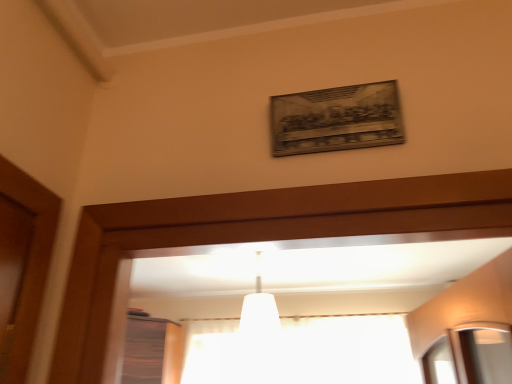
Image resolution: width=512 pixels, height=384 pixels. Describe the element at coordinates (259, 311) in the screenshot. I see `white matte lampshade at center` at that location.

Find the location of `white matte lampshade at center`. white matte lampshade at center is located at coordinates (259, 311).

What do you see at coordinates (347, 349) in the screenshot? The height and width of the screenshot is (384, 512). I see `white fabric curtain at center` at bounding box center [347, 349].

Where is `white fabric curtain at center`? The image size is (512, 384). white fabric curtain at center is located at coordinates (347, 349).

Where is `white matte lampshade at center`? Image resolution: width=512 pixels, height=384 pixels. white matte lampshade at center is located at coordinates (x=259, y=311).

Between white fabric curtain at center and white matte lampshade at center, which one appears on the right side from the viewer's perspective?

From the viewer's perspective, white fabric curtain at center appears more on the right side.

Which is in front, white fabric curtain at center or white matte lampshade at center?

white matte lampshade at center is closer to the camera.

Is point (347, 372) closer or farther from the camera than point (261, 319)?

Point (347, 372).

From the picture: From the image's perspective, is white fabric curtain at center above or below white matte lampshade at center?

white fabric curtain at center is below white matte lampshade at center.

From a real-world perspective, is white fabric curtain at center physically below white matte lampshade at center?

Yes, from a real-world perspective, white fabric curtain at center is under white matte lampshade at center.

In the scene shown: Considering the relative sizes of white fabric curtain at center and white matte lampshade at center in the image provided, is white fabric curtain at center wider than white matte lampshade at center?

No.

Considering the sizes of white fabric curtain at center and white matte lampshade at center in the image, is white fabric curtain at center taller or shorter than white matte lampshade at center?

white fabric curtain at center is shorter than white matte lampshade at center.

Consider the image. Considering the relative sizes of white fabric curtain at center and white matte lampshade at center in the image provided, is white fabric curtain at center smaller than white matte lampshade at center?

Incorrect, white fabric curtain at center is not smaller in size than white matte lampshade at center.

Is white fabric curtain at center inside the boundaries of white matte lampshade at center, or outside?

white fabric curtain at center is not enclosed by white matte lampshade at center.

Is white fabric curtain at center with white matte lampshade at center?

No, white fabric curtain at center is not next to white matte lampshade at center.

Is white fabric curtain at center turned away from white matte lampshade at center?

No, white fabric curtain at center is not facing the opposite direction of white matte lampshade at center.

The width and height of the screenshot is (512, 384). I want to click on fixture above the white fabric curtain at center (from the image's perspective), so click(x=259, y=311).

Which is more to the right, white matte lampshade at center or white fabric curtain at center?

white fabric curtain at center.

Does white matte lampshade at center lie in front of white fabric curtain at center?

Yes, it is in front of white fabric curtain at center.

Is point (272, 299) closer to camera compared to point (311, 333)?

Yes, it is.

From the image's perspective, between white matte lampshade at center and white fabric curtain at center, who is located below?

white fabric curtain at center appears lower in the image.

From a real-world perspective, which object rests below the other?

From a 3D spatial view, white fabric curtain at center is below.

Is white matte lampshade at center wider than white fabric curtain at center?

Indeed, white matte lampshade at center has a greater width compared to white fabric curtain at center.

Is white matte lampshade at center taller than white fabric curtain at center?

Indeed, white matte lampshade at center has a greater height compared to white fabric curtain at center.

Can you confirm if white matte lampshade at center is smaller than white fabric curtain at center?

Yes.

Looking at this image, can white fabric curtain at center be found inside white matte lampshade at center?

No, white fabric curtain at center is not inside white matte lampshade at center.

Is white matte lampshade at center not near white fabric curtain at center?

Yes.

Is white matte lampshade at center positioned with its back to white fabric curtain at center?

That's not correct — white matte lampshade at center is not looking away from white fabric curtain at center.

Can you tell me how much white matte lampshade at center and white fabric curtain at center differ in facing direction?

98.9 degrees separate the facing orientations of white matte lampshade at center and white fabric curtain at center.

At what (x,y) coordinates should I click in order to perform the action: click on curtain behind the white matte lampshade at center. Please return your answer as a coordinate pair (x, y). Image resolution: width=512 pixels, height=384 pixels. Looking at the image, I should click on (347, 349).

At what (x,y) coordinates should I click in order to perform the action: click on fixture located above the white fabric curtain at center (from the image's perspective). Please return your answer as a coordinate pair (x, y). The width and height of the screenshot is (512, 384). Looking at the image, I should click on (259, 311).

Identify the location of fixture lying on the left of white fabric curtain at center. Image resolution: width=512 pixels, height=384 pixels. (259, 311).